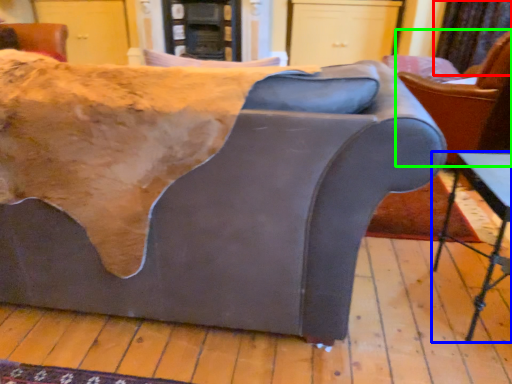
Question: Which object is the closest to the curtain (highlighted by a red box)? Choose among these: table (highlighted by a blue box) or chair (highlighted by a green box).

Choices:
 (A) table
 (B) chair

Answer: (B)